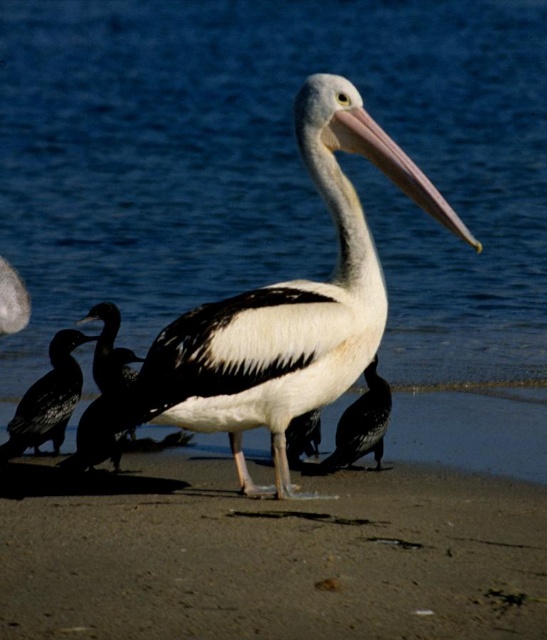
From the picture: Is shiny black bird at lower left shorter than white smooth beak at center?

Incorrect, shiny black bird at lower left's height does not fall short of white smooth beak at center's.

Is shiny black bird at lower left further to camera compared to white smooth beak at center?

That is True.

Find the location of a particular element. This screenshot has height=640, width=547. shiny black bird at lower left is located at coordinates (48, 400).

Locate an element on the screen. This screenshot has height=640, width=547. shiny black bird at lower left is located at coordinates coord(48,400).

Does sandy brown at center have a smaller size compared to black glossy bird at center?

Actually, sandy brown at center might be larger than black glossy bird at center.

From the picture: Does sandy brown at center lie in front of black glossy bird at center?

Yes, sandy brown at center is in front of black glossy bird at center.

The width and height of the screenshot is (547, 640). I want to click on sandy brown at center, so click(x=267, y=556).

From the picture: Is shiny black bird at lower left shorter than black glossy bird at center?

Incorrect, shiny black bird at lower left's height does not fall short of black glossy bird at center's.

Is point (72, 348) closer to viewer compared to point (363, 413)?

That is False.

The image size is (547, 640). What are the coordinates of `shiny black bird at lower left` in the screenshot? It's located at (48, 400).